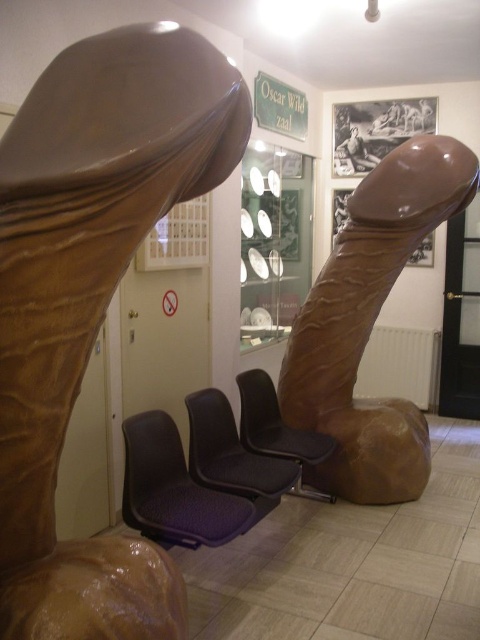
Can you confirm if purple fabric daybed at center is bigger than purple fabric armchair at center?

Correct, purple fabric daybed at center is larger in size than purple fabric armchair at center.

Between point (199, 410) and point (144, 474), which one is positioned in front?

Point (144, 474)

You are a GUI agent. You are given a task and a screenshot of the screen. Output one action in this format:
    pyautogui.click(x=<x>, y=<y>)
    Task: Click on the purple fabric daybed at center
    This screenshot has width=480, height=640.
    Given the screenshot: What is the action you would take?
    pyautogui.click(x=215, y=465)

Who is more forward, (429, 442) or (323, 440)?

Point (323, 440)

Does brown glossy sculpture at center appear under black fabric armchair at center?

Incorrect, brown glossy sculpture at center is not positioned below black fabric armchair at center.

Between point (410, 138) and point (314, 497), which one is positioned in front?

Positioned in front is point (314, 497).

Identify the location of brown glossy sculpture at center. (371, 323).

Which of these two, purple fabric armchair at center or black fabric armchair at center, stands shorter?

Standing shorter between the two is black fabric armchair at center.

Is purple fabric armchair at center positioned at the back of black fabric armchair at center?

That is False.

Does point (178, 442) come in front of point (269, 384)?

That is True.

Identify the location of purple fabric armchair at center. The height and width of the screenshot is (640, 480). [176, 490].